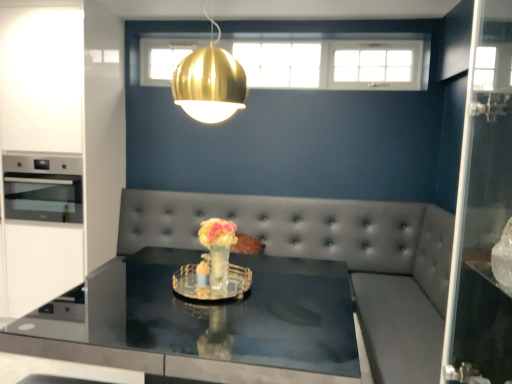
Question: Should I look upward or downward to see white glossy cabinetry at left?

Choices:
 (A) down
 (B) up

Answer: (B)

Question: Is translucent glass vase at center at the back of stainless steel oven at left?

Choices:
 (A) no
 (B) yes

Answer: (A)

Question: From a real-world perspective, does stainless steel oven at left stand above translucent glass vase at center?

Choices:
 (A) yes
 (B) no

Answer: (A)

Question: Does stainless steel oven at left contain translucent glass vase at center?

Choices:
 (A) yes
 (B) no

Answer: (B)

Question: Does stainless steel oven at left appear on the right side of translucent glass vase at center?

Choices:
 (A) yes
 (B) no

Answer: (B)

Question: Does stainless steel oven at left turn towards translucent glass vase at center?

Choices:
 (A) yes
 (B) no

Answer: (B)

Question: Does stainless steel oven at left have a lesser height compared to translucent glass vase at center?

Choices:
 (A) yes
 (B) no

Answer: (B)

Question: Considering the relative positions of stainless steel oven at left and shiny black glass table at center in the image provided, is stainless steel oven at left to the right of shiny black glass table at center from the viewer's perspective?

Choices:
 (A) no
 (B) yes

Answer: (A)

Question: Is stainless steel oven at left smaller than shiny black glass table at center?

Choices:
 (A) no
 (B) yes

Answer: (B)

Question: From a real-world perspective, is stainless steel oven at left on shiny black glass table at center?

Choices:
 (A) yes
 (B) no

Answer: (A)

Question: From the image's perspective, is stainless steel oven at left located above shiny black glass table at center?

Choices:
 (A) yes
 (B) no

Answer: (A)

Question: Does stainless steel oven at left touch shiny black glass table at center?

Choices:
 (A) yes
 (B) no

Answer: (B)

Question: Are stainless steel oven at left and shiny black glass table at center far apart?

Choices:
 (A) no
 (B) yes

Answer: (B)

Question: Can you confirm if gold metallic pendant light at upper center is shorter than translucent glass vase at center?

Choices:
 (A) no
 (B) yes

Answer: (A)